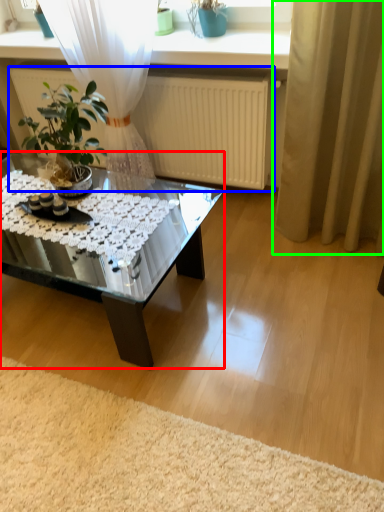
Question: Which object is positioned closest to coffee table (highlighted by a red box)? Select from radiator (highlighted by a blue box) and curtain (highlighted by a green box).

Choices:
 (A) radiator
 (B) curtain

Answer: (A)